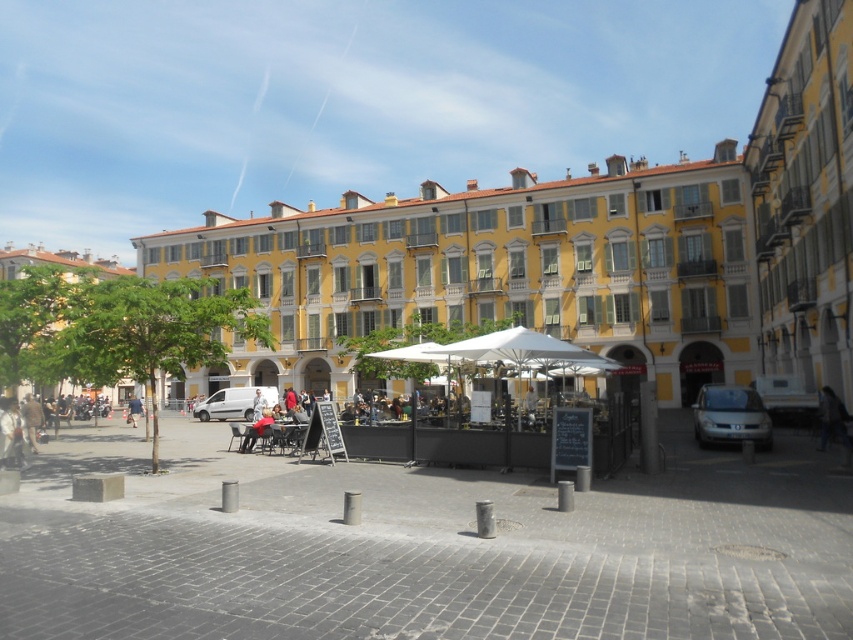
You are a photographer standing in the urban square and want to capture both the denim jacket at center and the denim jacket at lower left in a single photo. Given that your camera has a maximum focal length that allows capturing objects up to 15 meters apart, will you be able to include both jackets in the frame?

The denim jacket at center and denim jacket at lower left are 18.31 meters apart from each other, which exceeds the camera maximum focal length of 15 meters. Therefore, you cannot include both jackets in the frame.

You are standing in the urban square and want to place a denim jacket at center. Is there enough space to place it at point (256, 429)?

The denim jacket at center is located at point (256, 429), so yes, there is space to place it there.